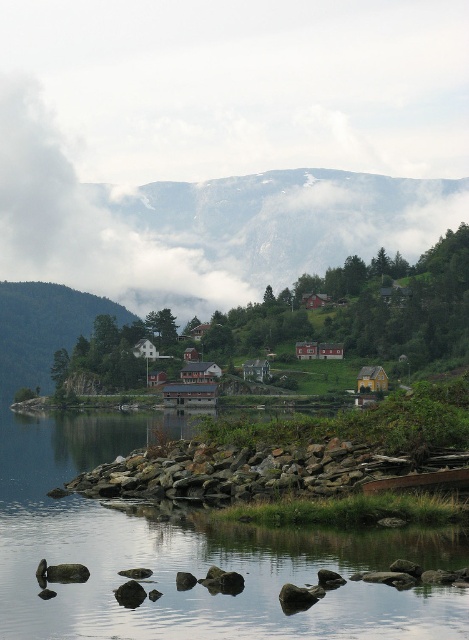
Which is above, smooth rock water at lower center or rocky gray mountain at upper center?

rocky gray mountain at upper center

Does point (95, 566) come closer to viewer compared to point (203, 184)?

Yes, it is in front of point (203, 184).

At what (x,y) coordinates should I click in order to perform the action: click on smooth rock water at lower center. Please return your answer as a coordinate pair (x, y). This screenshot has height=640, width=469. Looking at the image, I should click on (190, 554).

Does smooth rock water at lower center come in front of rocky shore at lower center?

Yes, smooth rock water at lower center is closer to the viewer.

Is smooth rock water at lower center thinner than rocky shore at lower center?

In fact, smooth rock water at lower center might be wider than rocky shore at lower center.

Is point (161, 625) positioned behind point (296, 474)?

No, (161, 625) is in front of (296, 474).

You are a GUI agent. You are given a task and a screenshot of the screen. Output one action in this format:
    pyautogui.click(x=<x>, y=<y>)
    Task: Click on the smooth rock water at lower center
    
    Given the screenshot: What is the action you would take?
    pyautogui.click(x=190, y=554)

Who is more distant from viewer, (134, 216) or (53, 310)?

Positioned behind is point (134, 216).

Which is in front, point (199, 216) or point (58, 317)?

Point (58, 317) is in front.

The image size is (469, 640). Find the location of `rocky gray mountain at upper center`. rocky gray mountain at upper center is located at coordinates click(x=277, y=225).

Where is `rocky gray mountain at upper center`? rocky gray mountain at upper center is located at coordinates (277, 225).